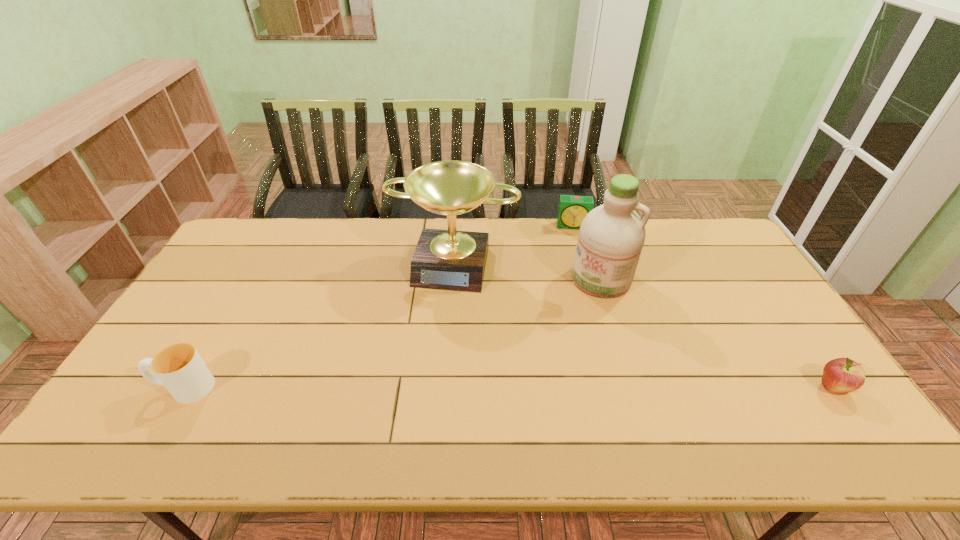
Locate an element on the screen. free spot on the desktop that is between the leftmost object and the apple and is positioned on the front-facing side of the second object from left to right is located at coordinates (422, 388).

Identify the location of vacant spot on the desktop that is between the cup and the rightmost object and is positioned on the front-facing side of the farthest object. The width and height of the screenshot is (960, 540). (587, 388).

Find the location of a particular element. The width and height of the screenshot is (960, 540). free spot on the desktop that is between the leftmost object and the rightmost object and is positioned on the front label of the cleansing agent is located at coordinates (528, 388).